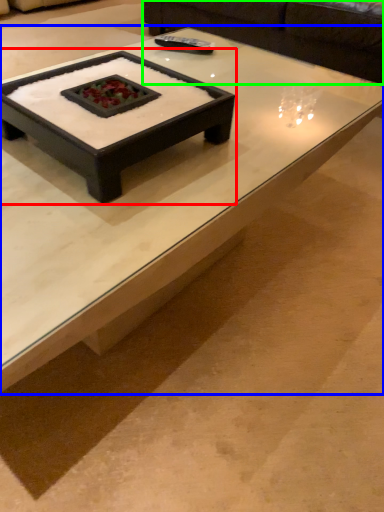
Question: Which object is positioned farthest from coffee table (highlighted by a red box)? Select from coffee table (highlighted by a blue box) and couch (highlighted by a green box).

Choices:
 (A) coffee table
 (B) couch

Answer: (B)